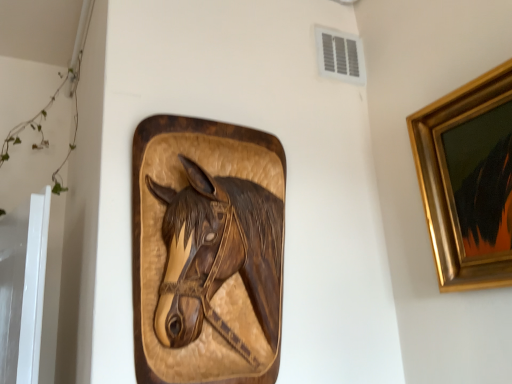
In order to click on white plastic vent at upper center in this screenshot , I will do `click(340, 55)`.

This screenshot has height=384, width=512. What do you see at coordinates (468, 180) in the screenshot?
I see `gold-framed painting at upper right` at bounding box center [468, 180].

This screenshot has width=512, height=384. What are the coordinates of `white plastic vent at upper center` in the screenshot? It's located at (340, 55).

Does white plastic vent at upper center have a lesser height compared to gold-framed painting at upper right?

Yes.

How distant is white plastic vent at upper center from gold-framed painting at upper right?

A distance of 18.53 inches exists between white plastic vent at upper center and gold-framed painting at upper right.

Can you confirm if white plastic vent at upper center is wider than gold-framed painting at upper right?

Incorrect, the width of white plastic vent at upper center does not surpass that of gold-framed painting at upper right.

Which object is positioned more to the right, white plastic vent at upper center or gold-framed painting at upper right?

From the viewer's perspective, gold-framed painting at upper right appears more on the right side.

Based on their sizes in the image, would you say gold-framed painting at upper right is bigger or smaller than white plastic vent at upper center?

In the image, gold-framed painting at upper right appears to be larger than white plastic vent at upper center.

Considering the relative positions of gold-framed painting at upper right and white plastic vent at upper center in the image provided, is gold-framed painting at upper right behind white plastic vent at upper center?

No.

Measure the distance between gold-framed painting at upper right and white plastic vent at upper center.

18.53 inches.

From the image's perspective, between gold-framed painting at upper right and white plastic vent at upper center, who is located below?

gold-framed painting at upper right is shown below in the image.

Between wooden carved horse head at center and gold-framed painting at upper right, which one appears on the left side from the viewer's perspective?

wooden carved horse head at center.

From a real-world perspective, which object rests below the other?

In real-world perspective, wooden carved horse head at center is lower.

Looking at the image, does wooden carved horse head at center seem bigger or smaller compared to gold-framed painting at upper right?

Clearly, wooden carved horse head at center is larger in size than gold-framed painting at upper right.

Considering the sizes of gold-framed painting at upper right and wooden carved horse head at center in the image, is gold-framed painting at upper right taller or shorter than wooden carved horse head at center?

Considering their sizes, gold-framed painting at upper right has less height than wooden carved horse head at center.

Is gold-framed painting at upper right at the right side of wooden carved horse head at center?

Yes.

Which is in front, gold-framed painting at upper right or wooden carved horse head at center?

gold-framed painting at upper right is in front.

Can you confirm if gold-framed painting at upper right is bigger than wooden carved horse head at center?

No, gold-framed painting at upper right is not bigger than wooden carved horse head at center.

Considering the sizes of objects wooden carved horse head at center and white plastic vent at upper center in the image provided, who is taller, wooden carved horse head at center or white plastic vent at upper center?

Standing taller between the two is wooden carved horse head at center.

Is wooden carved horse head at center far from white plastic vent at upper center?

No, there isn't a large distance between wooden carved horse head at center and white plastic vent at upper center.

Is point (248, 278) in front of point (328, 69)?

That is True.

Is point (358, 44) positioned behind point (170, 256)?

Yes, point (358, 44) is farther from viewer.

Is white plastic vent at upper center aimed at wooden carved horse head at center?

No, white plastic vent at upper center does not turn towards wooden carved horse head at center.

Is white plastic vent at upper center taller or shorter than wooden carved horse head at center?

white plastic vent at upper center is shorter than wooden carved horse head at center.

Find the location of a particular element. This screenshot has width=512, height=384. horse that is on the left side of white plastic vent at upper center is located at coordinates (218, 255).

The width and height of the screenshot is (512, 384). I want to click on air conditioning behind the gold-framed painting at upper right, so click(x=340, y=55).

At what (x,y) coordinates should I click in order to perform the action: click on air conditioning above the gold-framed painting at upper right (from a real-world perspective). Please return your answer as a coordinate pair (x, y). The width and height of the screenshot is (512, 384). Looking at the image, I should click on (340, 55).

Considering their positions, is gold-framed painting at upper right positioned further to wooden carved horse head at center than white plastic vent at upper center?

white plastic vent at upper center.

Which object lies nearer to the anchor point white plastic vent at upper center, gold-framed painting at upper right or wooden carved horse head at center?

gold-framed painting at upper right.

Based on their spatial positions, is wooden carved horse head at center or gold-framed painting at upper right further from white plastic vent at upper center?

wooden carved horse head at center.

In the scene shown: Looking at the image, which one is located closer to wooden carved horse head at center, white plastic vent at upper center or gold-framed painting at upper right?

Based on the image, gold-framed painting at upper right appears to be nearer to wooden carved horse head at center.

Based on their spatial positions, is white plastic vent at upper center or wooden carved horse head at center further from gold-framed painting at upper right?

Based on the image, white plastic vent at upper center appears to be further to gold-framed painting at upper right.

From the picture: Looking at the image, which one is located further to gold-framed painting at upper right, wooden carved horse head at center or white plastic vent at upper center?

white plastic vent at upper center is positioned further to the anchor gold-framed painting at upper right.

At what (x,y) coordinates should I click in order to perform the action: click on horse positioned between gold-framed painting at upper right and white plastic vent at upper center from near to far. Please return your answer as a coordinate pair (x, y). The width and height of the screenshot is (512, 384). Looking at the image, I should click on (218, 255).